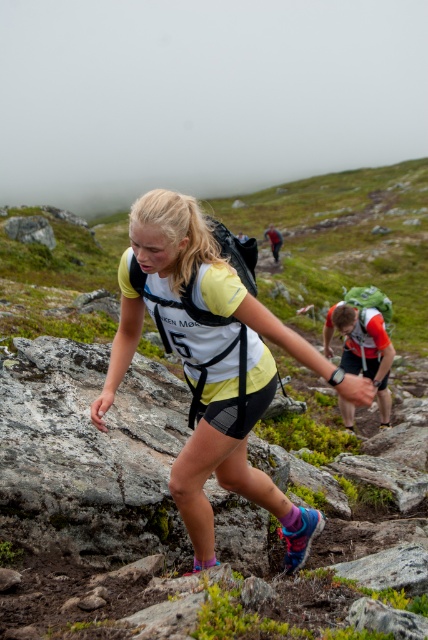
Who is taller, yellow fabric shirt at center or orange mesh backpack at center?

Standing taller between the two is orange mesh backpack at center.

Is point (351, 401) farther from camera compared to point (379, 310)?

No, it is in front of (379, 310).

Where is `yellow fabric shirt at center`? The width and height of the screenshot is (428, 640). yellow fabric shirt at center is located at coordinates (211, 364).